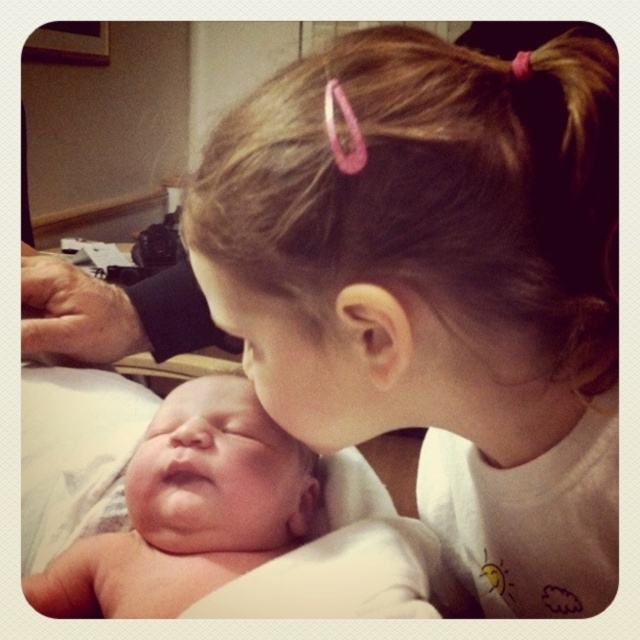
You are a photographer standing 12 inches away from the scene. You want to capture a closeup of the white soft hair at upper center without moving your position. Can you do it with a standard camera lens that has a minimum focusing distance of 10 inches?

The white soft hair at upper center is 11.38 inches away from the viewer. Since the camera lens can focus as close as 10 inches, which is closer than the 11.38 inches distance, you can capture the closeup without moving your position.

You are a photographer trying to capture the children without moving them. You want to focus on the point that is closer to the camera. Which point should you choose between point (x=365, y=337) and point (x=141, y=529)?

Point (x=365, y=337) is in front of point (x=141, y=529), so you should focus on point (x=365, y=337) to capture the children without moving them.